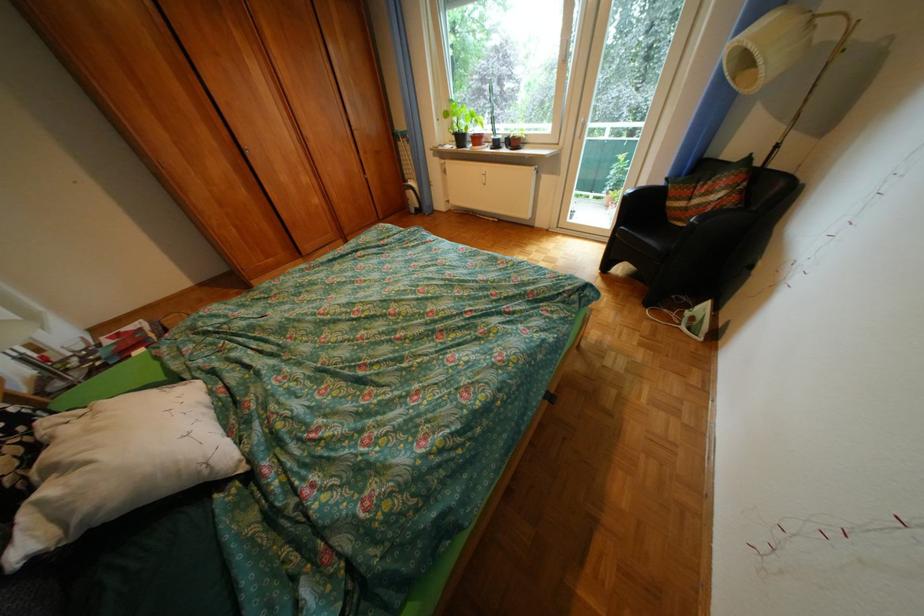
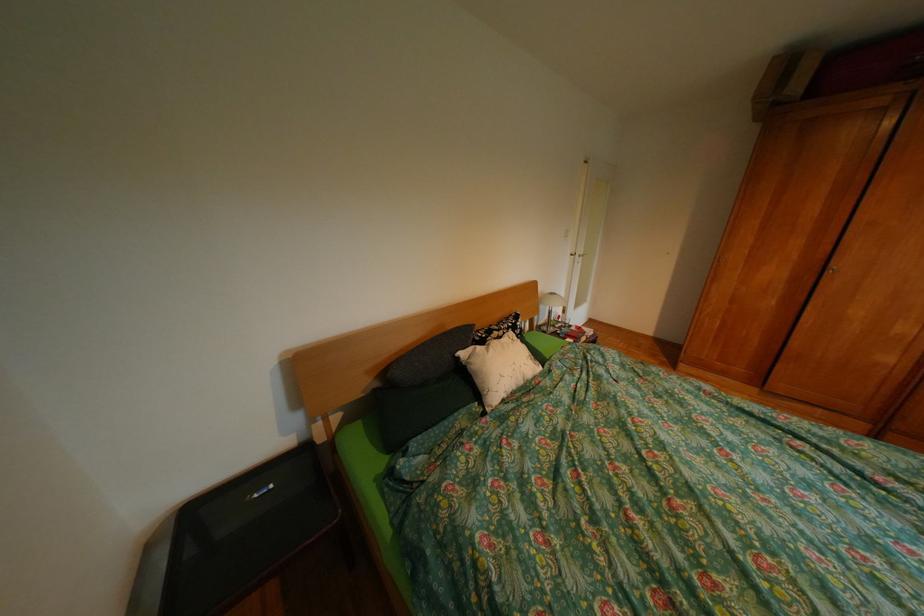
Consider the image. How did the camera likely rotate?

The camera rotated toward left-down.